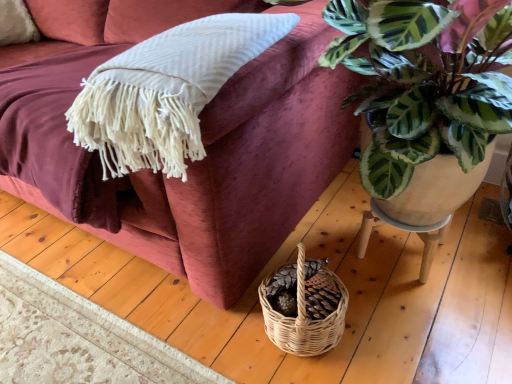
Question: Based on their positions, is wooden stool at lower right located to the left or right of velvet maroon couch at upper left?

Choices:
 (A) right
 (B) left

Answer: (A)

Question: Is wooden stool at lower right wider or thinner than velvet maroon couch at upper left?

Choices:
 (A) wide
 (B) thin

Answer: (B)

Question: Is wooden stool at lower right in front of or behind velvet maroon couch at upper left in the image?

Choices:
 (A) behind
 (B) front

Answer: (A)

Question: Is velvet maroon couch at upper left situated inside wooden stool at lower right or outside?

Choices:
 (A) outside
 (B) inside

Answer: (A)

Question: From the image's perspective, is velvet maroon couch at upper left located above or below wooden stool at lower right?

Choices:
 (A) above
 (B) below

Answer: (A)

Question: From a real-world perspective, is velvet maroon couch at upper left physically located above or below wooden stool at lower right?

Choices:
 (A) below
 (B) above

Answer: (B)

Question: Considering the positions of velvet maroon couch at upper left and wooden stool at lower right in the image, is velvet maroon couch at upper left wider or thinner than wooden stool at lower right?

Choices:
 (A) thin
 (B) wide

Answer: (B)